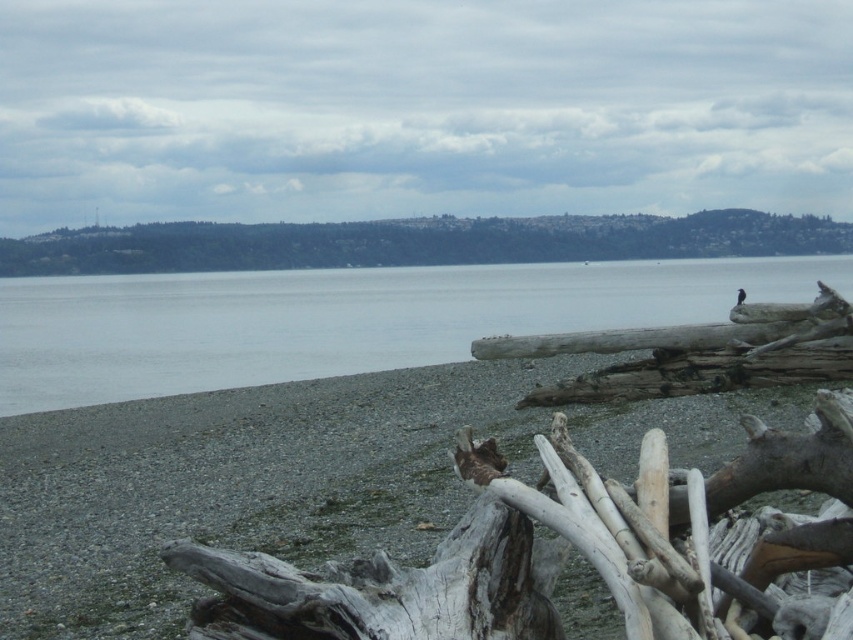
Is gray water at center above gray weathered log at right?

Indeed, gray water at center is positioned over gray weathered log at right.

Is gray water at center further to the viewer compared to gray weathered log at right?

Yes, it is behind gray weathered log at right.

Is point (231, 340) positioned behind point (521, 404)?

Yes, it is behind point (521, 404).

Where is `gray water at center`? The width and height of the screenshot is (853, 640). gray water at center is located at coordinates (341, 320).